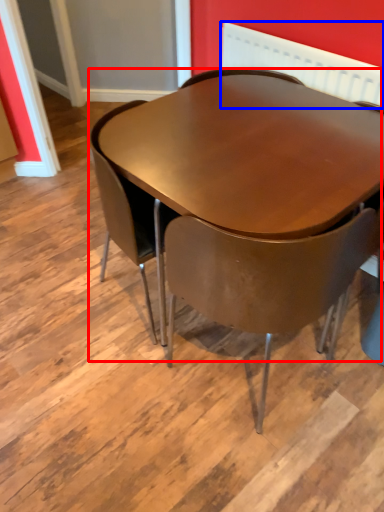
Question: Which of the following is the closest to the observer, table (highlighted by a red box) or radiator (highlighted by a blue box)?

Choices:
 (A) table
 (B) radiator

Answer: (A)